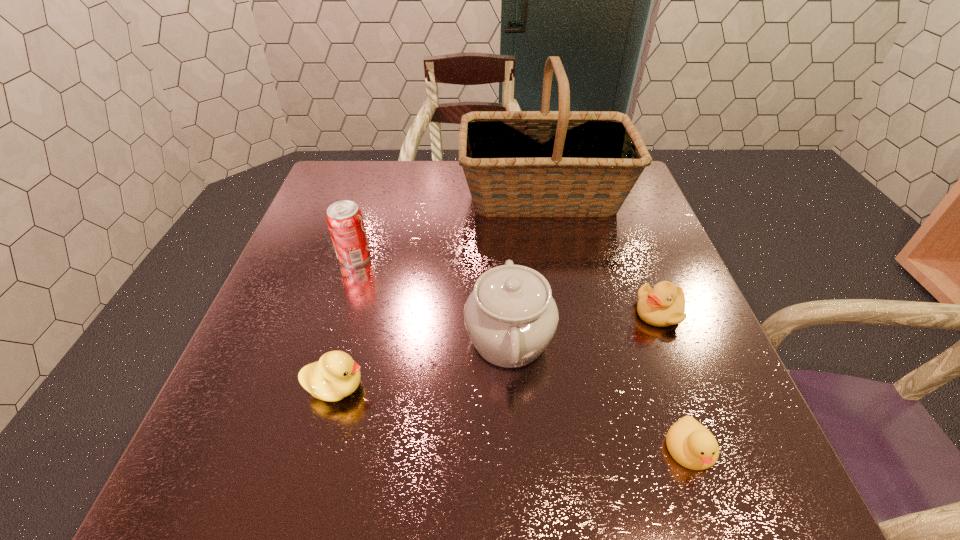
At what (x,y) coordinates should I click in order to perform the action: click on vacant space located 0.380m by the handle of the farthest object. Please return your answer as a coordinate pair (x, y). The height and width of the screenshot is (540, 960). Looking at the image, I should click on 324,195.

Find the location of a particular element. vacant area situated by the handle of the farthest object is located at coordinates (403, 195).

Locate an element on the screen. The height and width of the screenshot is (540, 960). vacant area located 0.100m on the front of the chinaware is located at coordinates (516, 445).

This screenshot has height=540, width=960. Identify the location of free space located 0.120m on the back of the second farthest object. (367, 217).

In order to click on vacant area situated 0.160m on the beak of the second farthest duckling in this screenshot , I will do `click(456, 388)`.

Find the location of `vacant space located on the front-facing side of the farthest duckling`. vacant space located on the front-facing side of the farthest duckling is located at coordinates (482, 312).

The height and width of the screenshot is (540, 960). I want to click on free spot located on the front-facing side of the farthest duckling, so click(544, 312).

What are the coordinates of `free point located 0.280m on the front-facing side of the farthest duckling` in the screenshot? It's located at (501, 312).

Locate an element on the screen. The height and width of the screenshot is (540, 960). object that is at the far edge is located at coordinates (563, 163).

Image resolution: width=960 pixels, height=540 pixels. What are the coordinates of `object positioned at the near edge` in the screenshot? It's located at (692, 445).